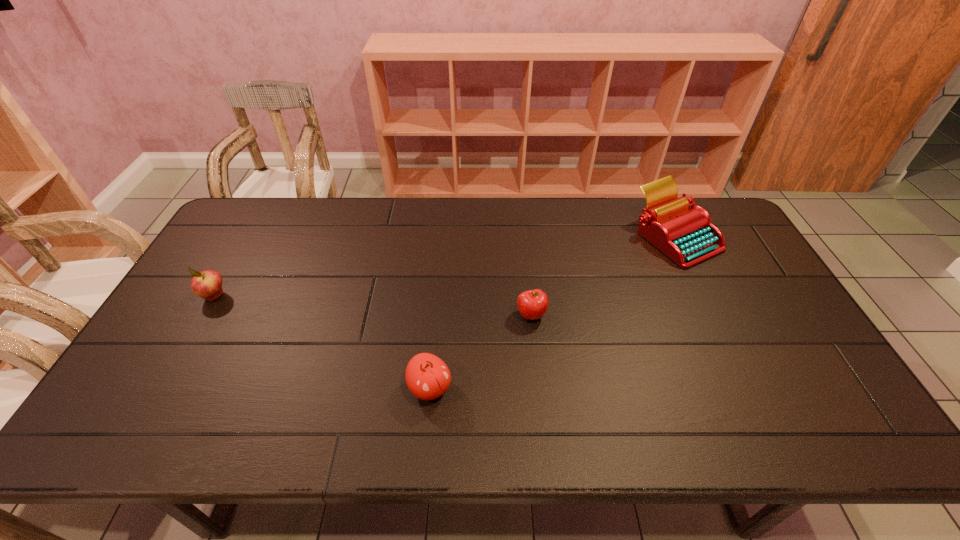
Identify the location of vacant space at the far left corner. The image size is (960, 540). (260, 223).

Locate an element on the screen. The image size is (960, 540). vacant area at the near right corner of the desktop is located at coordinates (792, 423).

Locate an element on the screen. The height and width of the screenshot is (540, 960). free space between the leftmost apple and the second apple from left to right is located at coordinates (322, 342).

I want to click on unoccupied area between the nearest object and the third object from left to right, so click(481, 352).

Image resolution: width=960 pixels, height=540 pixels. I want to click on unoccupied position between the leftmost apple and the farthest object, so click(445, 267).

Identify the location of vacant point located between the second apple from right to left and the typewriter. The image size is (960, 540). (553, 313).

Where is `free space between the farthest object and the leftmost object`? free space between the farthest object and the leftmost object is located at coordinates (445, 267).

Identify the location of empty space between the tallest object and the leftmost apple. (445, 267).

The width and height of the screenshot is (960, 540). Find the location of `empty space between the rightmost apple and the nearest object`. empty space between the rightmost apple and the nearest object is located at coordinates pos(481,352).

The height and width of the screenshot is (540, 960). I want to click on free spot between the shortest apple and the rightmost object, so click(x=604, y=276).